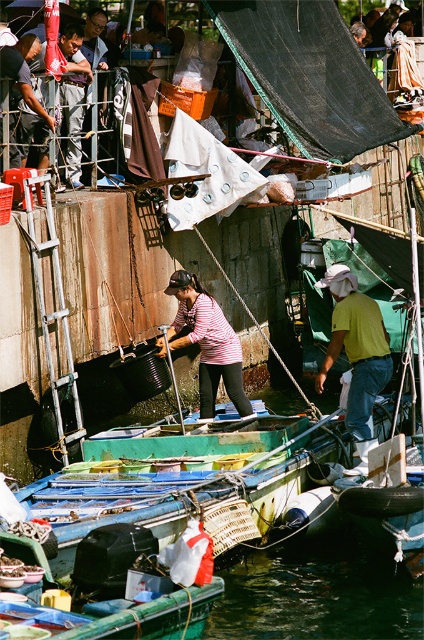
Does dark green water at lower center appear on the right side of matte black shirt at center?

Correct, you'll find dark green water at lower center to the right of matte black shirt at center.

Does point (323, 548) come closer to viewer compared to point (66, 38)?

Yes, point (323, 548) is closer to viewer.

Between point (337, 536) and point (72, 36), which one is positioned behind?

Point (72, 36)

Locate an element on the screen. dark green water at lower center is located at coordinates (318, 593).

In the scene shown: Is yellow matte shirt at center below dark blue shirt at center?

Indeed, yellow matte shirt at center is positioned under dark blue shirt at center.

How far apart are yellow matte shirt at center and dark blue shirt at center?

A distance of 44.77 feet exists between yellow matte shirt at center and dark blue shirt at center.

Describe the element at coordinates (357, 355) in the screenshot. I see `yellow matte shirt at center` at that location.

You are a GUI agent. You are given a task and a screenshot of the screen. Output one action in this format:
    pyautogui.click(x=<x>, y=<y>)
    Task: Click on the yellow matte shirt at center
    This screenshot has width=424, height=640.
    Given the screenshot: What is the action you would take?
    pyautogui.click(x=357, y=355)

From the picture: Does dark green water at lower center have a greater width compared to yellow matte shirt at center?

Correct, the width of dark green water at lower center exceeds that of yellow matte shirt at center.

Is dark green water at lower center above yellow matte shirt at center?

No, dark green water at lower center is not above yellow matte shirt at center.

Does point (331, 570) come closer to viewer compared to point (337, 353)?

That is True.

Identify the location of dark green water at lower center. The image size is (424, 640). (318, 593).